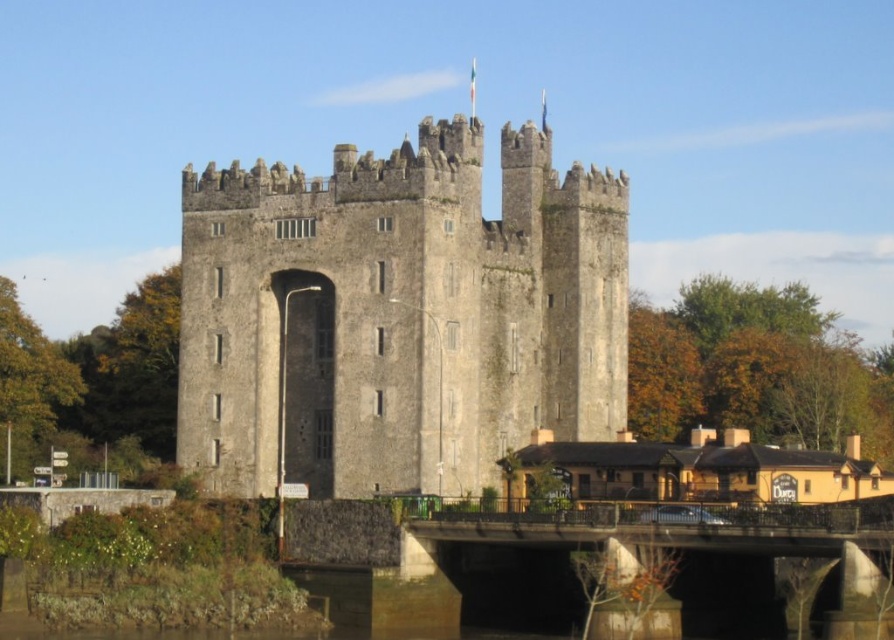
Question: Which point is closer to the camera taking this photo?

Choices:
 (A) (498, 392)
 (B) (873, 586)

Answer: (B)

Question: Can you confirm if gray stone castle at center is positioned to the right of concrete bridge at lower center?

Choices:
 (A) no
 (B) yes

Answer: (A)

Question: Is gray stone castle at center positioned in front of concrete bridge at lower center?

Choices:
 (A) yes
 (B) no

Answer: (B)

Question: Which point is closer to the camera?

Choices:
 (A) gray stone castle at center
 (B) concrete bridge at lower center

Answer: (B)

Question: Is gray stone castle at center in front of concrete bridge at lower center?

Choices:
 (A) yes
 (B) no

Answer: (B)